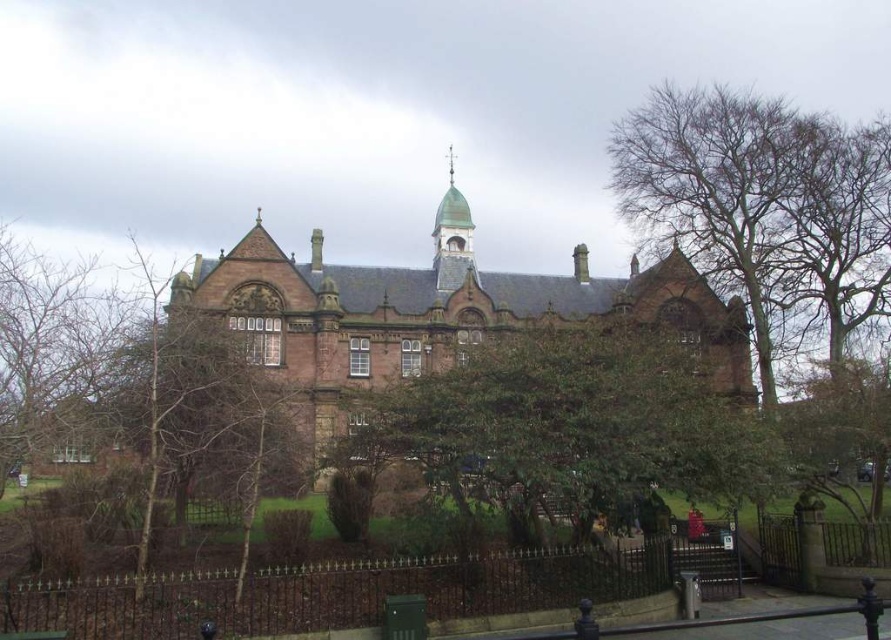
Question: Among these objects, which one is nearest to the camera?

Choices:
 (A) green leafy tree at center
 (B) brown stone church at center

Answer: (A)

Question: Can you confirm if brown stone church at center is wider than green leafy tree at center?

Choices:
 (A) no
 (B) yes

Answer: (B)

Question: Does brown stone church at center appear over green leafy tree at center?

Choices:
 (A) yes
 (B) no

Answer: (A)

Question: Where is brown stone church at center located in relation to green leafy tree at center in the image?

Choices:
 (A) left
 (B) right

Answer: (A)